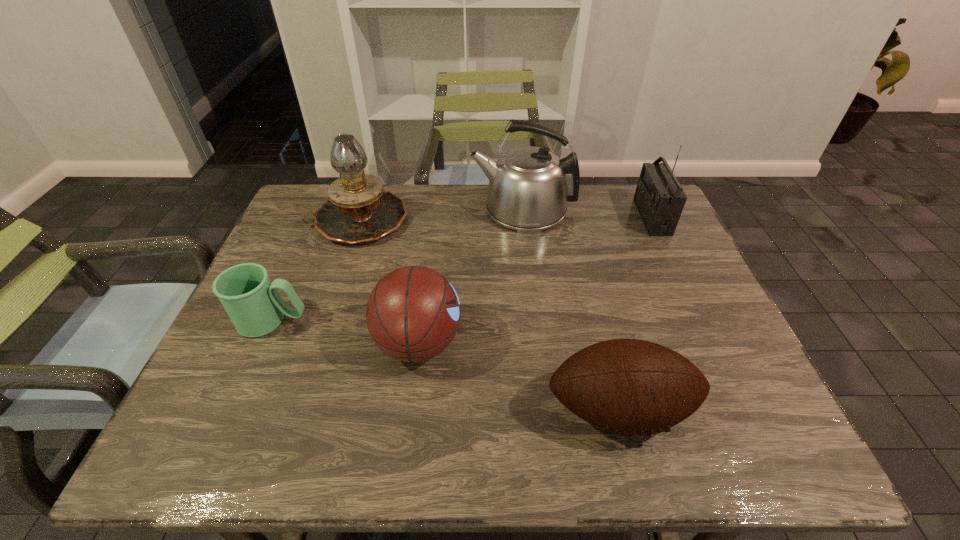
Identify the location of empty space between the kettle and the oil lamp. (441, 214).

Find the location of a particular element. The width and height of the screenshot is (960, 540). vacant space in between the kettle and the oil lamp is located at coordinates (441, 214).

Where is `vacant space that's between the basketball and the radio receiver`? Image resolution: width=960 pixels, height=540 pixels. vacant space that's between the basketball and the radio receiver is located at coordinates (535, 280).

This screenshot has width=960, height=540. In order to click on vacant space in between the rightmost object and the kettle in this screenshot , I will do `click(588, 213)`.

This screenshot has width=960, height=540. I want to click on unoccupied position between the football and the kettle, so click(x=571, y=309).

I want to click on free area in between the oil lamp and the shortest object, so coord(316,271).

Locate an element on the screen. This screenshot has width=960, height=540. vacant area that lies between the kettle and the football is located at coordinates (571, 309).

Image resolution: width=960 pixels, height=540 pixels. I want to click on object that is the nearest to the kettle, so click(659, 197).

Locate an element on the screen. object that stands as the second closest to the football is located at coordinates (659, 197).

Where is `free region that satisfies the following two spatial constraints: 1. on the side of the shortest object with the handle; 2. on the right side of the basketball`? The image size is (960, 540). free region that satisfies the following two spatial constraints: 1. on the side of the shortest object with the handle; 2. on the right side of the basketball is located at coordinates (263, 342).